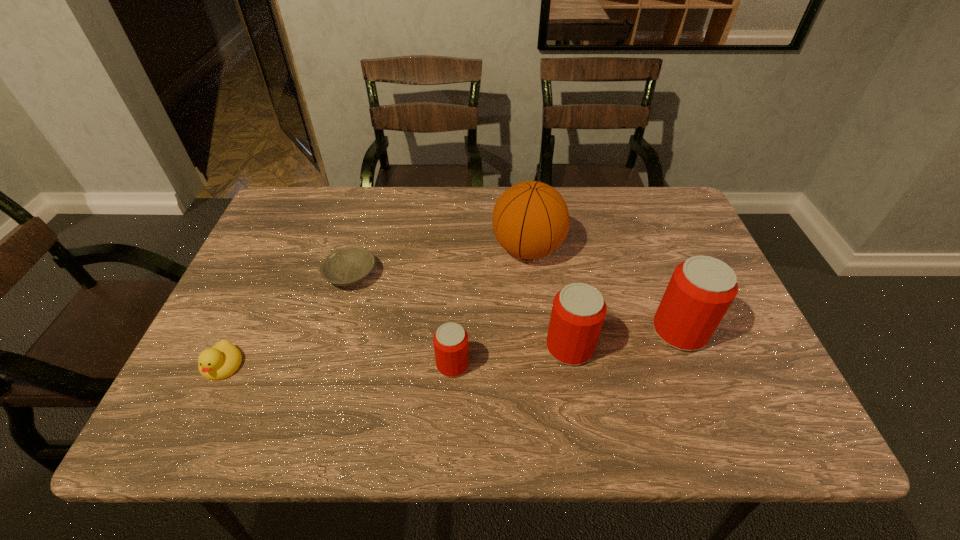
Please point a free position for a beer can on the left. Please provide its 2D coordinates. Your answer should be formatted as a tuple, i.e. [(x, y)], where the tuple contains the x and y coordinates of a point satisfying the conditions above.

[(327, 383)]